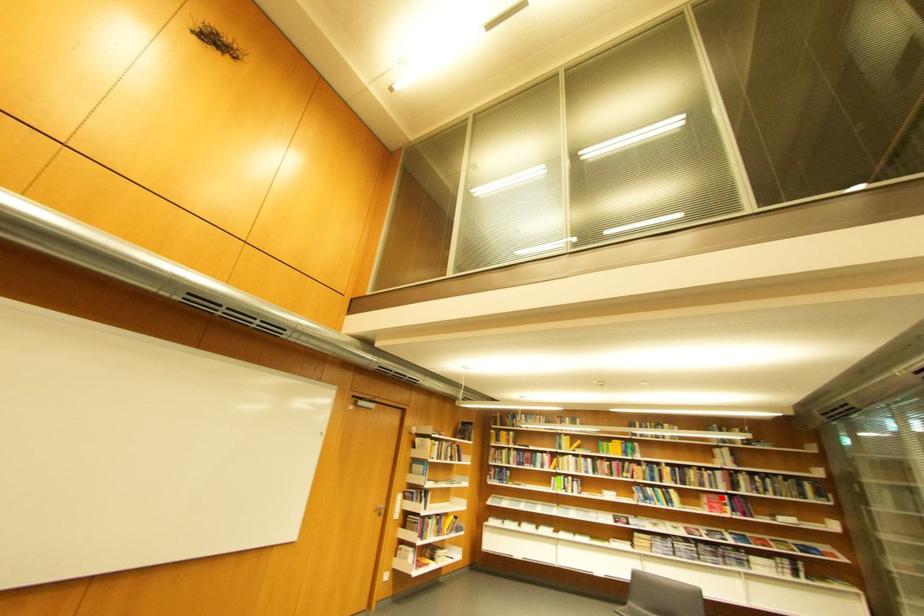
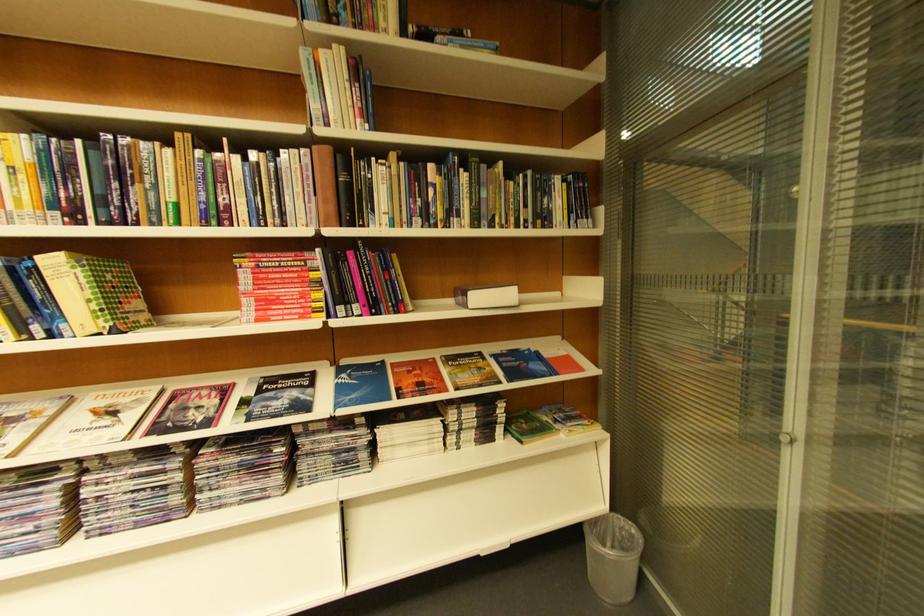
Where in the second image is the point corresponding to the highlighted location from the first image?

(281, 262)